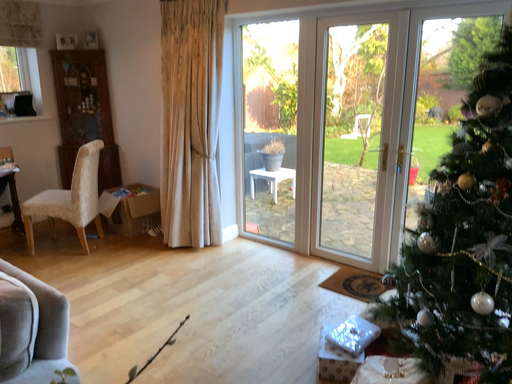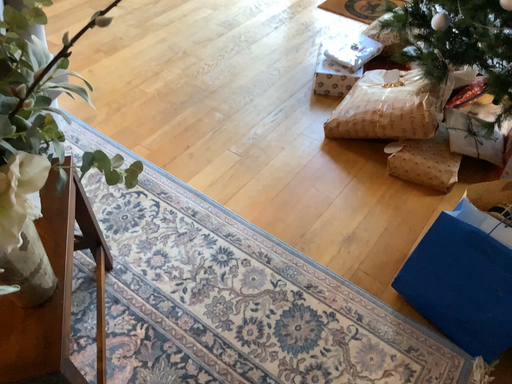
Question: How did the camera likely rotate when shooting the video?

Choices:
 (A) rotated downward
 (B) rotated upward

Answer: (A)